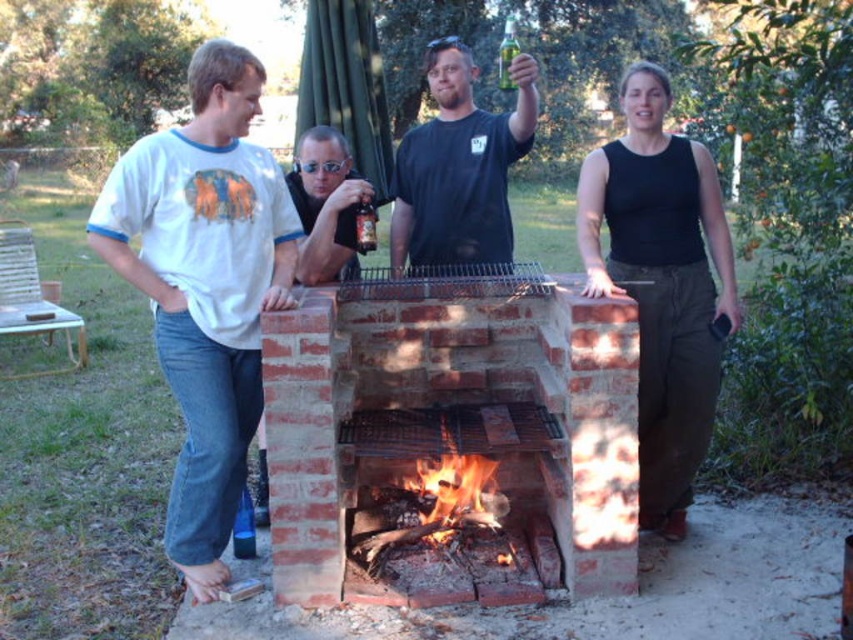
What is the color of the clothing worn by the person located at point (206,285)?

The person at point (206,285) is wearing a white t shirt.